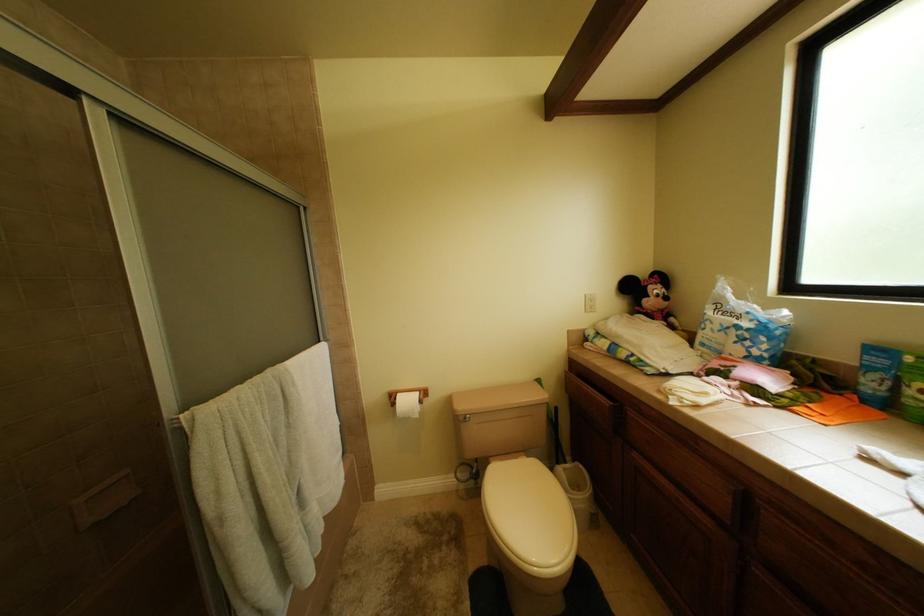
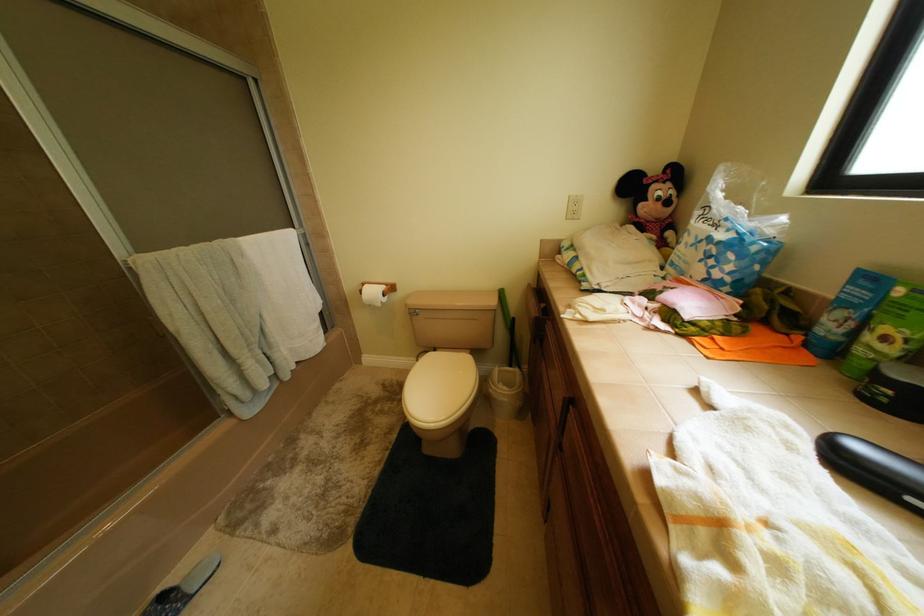
Question: In a continuous first-person perspective shot, in which direction is the camera moving?

Choices:
 (A) Left
 (B) Right
 (C) Forward
 (D) Backward

Answer: (B)